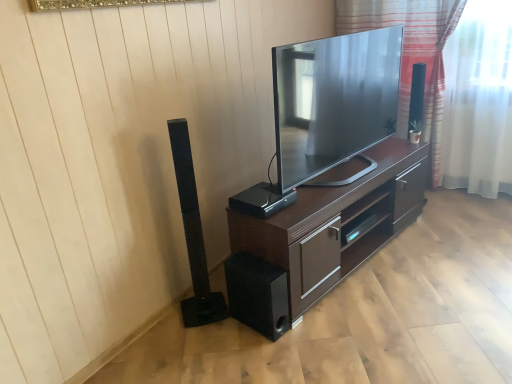
The image size is (512, 384). Identify the location of free point to the right of dark wood cabinet at center. (450, 246).